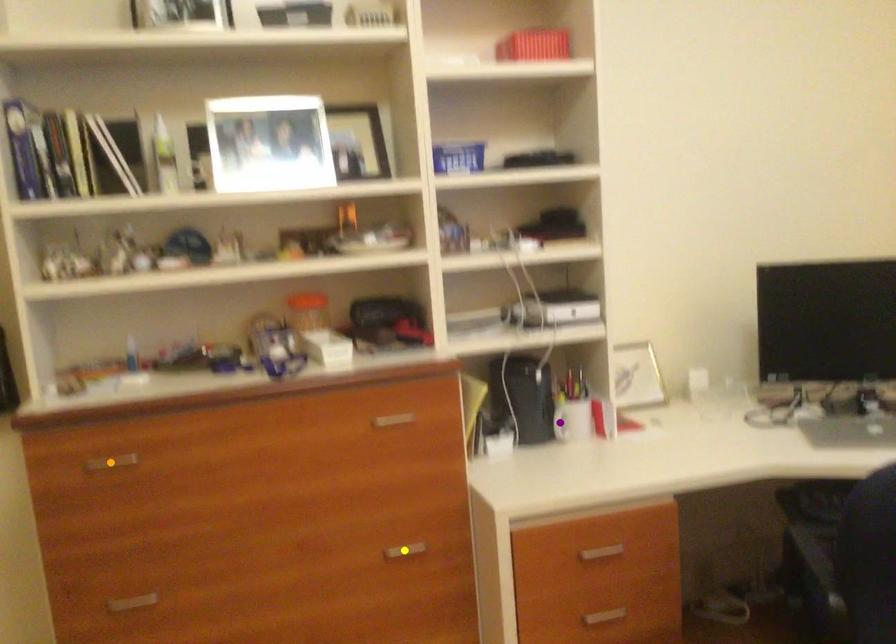
Order these from nearest to farthest:
- yellow point
- purple point
- orange point

orange point, yellow point, purple point